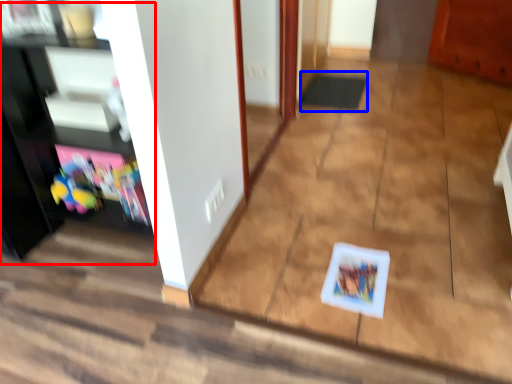
Question: Among these objects, which one is nearest to the camera, entertainment center (highlighted by a red box) or doormat (highlighted by a blue box)?

Choices:
 (A) entertainment center
 (B) doormat

Answer: (A)